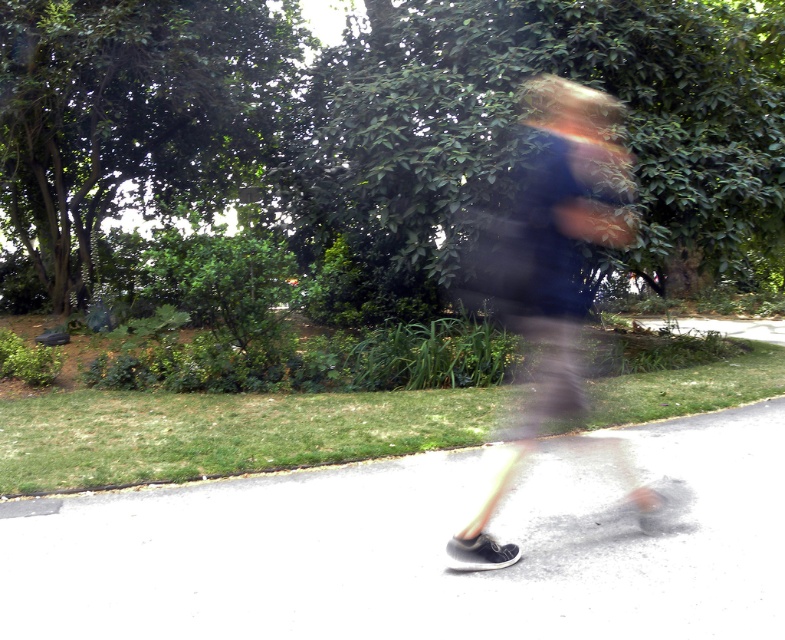
From the picture: Can you confirm if white asphalt at center is positioned to the right of dark blue fabric at center?

Incorrect, white asphalt at center is not on the right side of dark blue fabric at center.

Does white asphalt at center have a greater height compared to dark blue fabric at center?

No, white asphalt at center is not taller than dark blue fabric at center.

Is point (249, 500) positioned after point (535, 321)?

No, (249, 500) is in front of (535, 321).

The height and width of the screenshot is (640, 785). In order to click on white asphalt at center in this screenshot , I will do pyautogui.click(x=418, y=548).